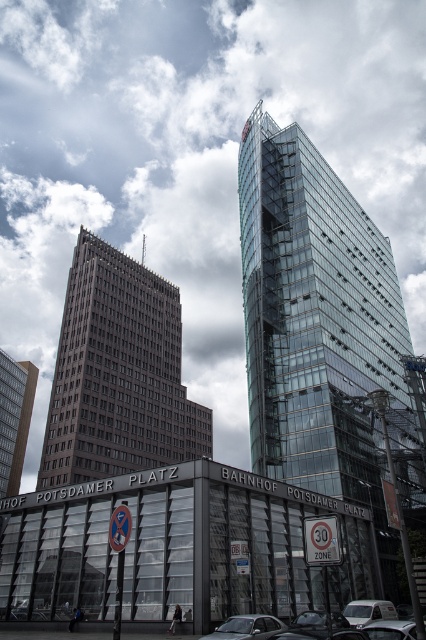
Question: Among these objects, which one is nearest to the camera?

Choices:
 (A) metallic silver car at lower center
 (B) transparent glass tower at center
 (C) brown brick building at center

Answer: (A)

Question: Can you confirm if transparent glass tower at center is wider than silver metallic car at lower center?

Choices:
 (A) yes
 (B) no

Answer: (A)

Question: Does transparent glass tower at center appear over metallic silver car at lower center?

Choices:
 (A) yes
 (B) no

Answer: (A)

Question: Which object is positioned farthest from the transparent glass tower at center?

Choices:
 (A) beige brick building at left
 (B) silver metallic car at lower center
 (C) brown brick building at center

Answer: (A)

Question: Is transparent glass tower at center smaller than brown brick building at center?

Choices:
 (A) yes
 (B) no

Answer: (A)

Question: Which object is closer to the camera taking this photo?

Choices:
 (A) transparent glass tower at center
 (B) silver metallic car at lower center
 (C) brown brick building at center

Answer: (B)